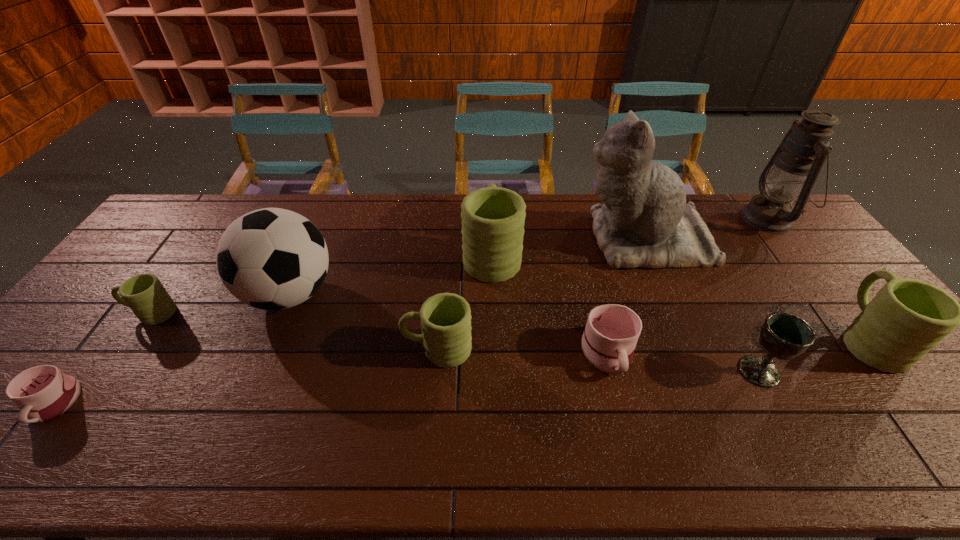
Identify the location of the leftmost green mug. The width and height of the screenshot is (960, 540). (144, 294).

I want to click on the second mug from right to left, so click(608, 343).

Identify the location of the right white mug. The height and width of the screenshot is (540, 960). (608, 343).

Image resolution: width=960 pixels, height=540 pixels. In order to click on the shortest object in this screenshot , I will do `click(42, 393)`.

Locate an element on the screen. The image size is (960, 540). the shortest mug is located at coordinates (42, 393).

Image resolution: width=960 pixels, height=540 pixels. Identify the location of blank space located on the front-facing side of the cat. (469, 239).

Where is `vacant space located 0.230m on the front-facing side of the cat`? The height and width of the screenshot is (540, 960). vacant space located 0.230m on the front-facing side of the cat is located at coordinates (509, 239).

This screenshot has width=960, height=540. I want to click on vacant position located 0.140m on the front-facing side of the cat, so click(x=536, y=239).

Locate an element on the screen. Image resolution: width=960 pixels, height=540 pixels. blank space located on the left of the brown oil lamp is located at coordinates (720, 219).

I want to click on vacant region located on the right of the black soccer ball, so click(x=396, y=294).